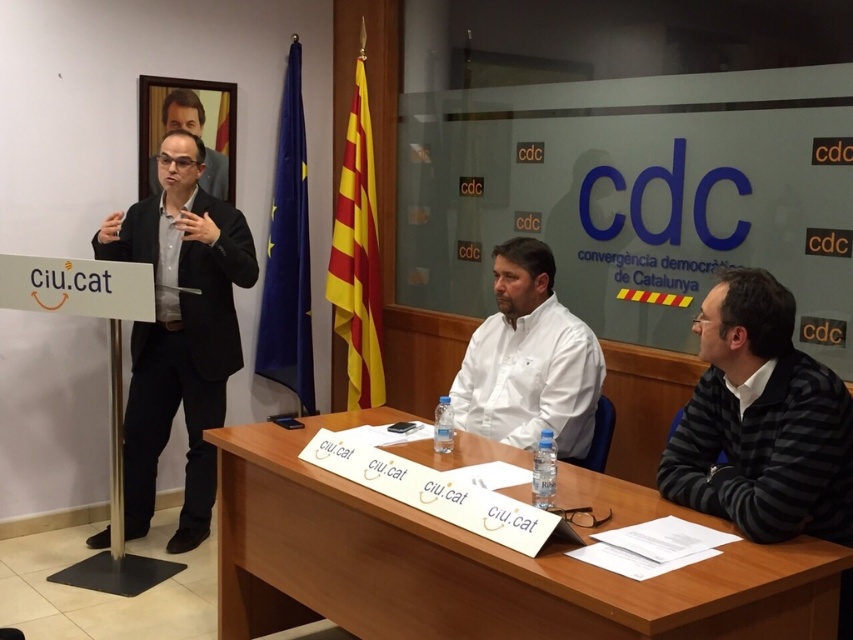
Question: Is light brown wooden table at center positioned at the back of matte black suit at upper left?

Choices:
 (A) no
 (B) yes

Answer: (A)

Question: Which point is closer to the camera?

Choices:
 (A) white cotton shirt at center
 (B) black suit at left
 (C) black striped sweater at right
 (D) light brown wooden table at center

Answer: (D)

Question: Which of the following is the closest to the observer?

Choices:
 (A) (703, 320)
 (B) (241, 355)

Answer: (A)

Question: Is black striped sweater at right to the right of matte black suit at upper left from the viewer's perspective?

Choices:
 (A) yes
 (B) no

Answer: (A)

Question: Is light brown wooden table at center to the right of white cotton shirt at center from the viewer's perspective?

Choices:
 (A) yes
 (B) no

Answer: (B)

Question: Which of the following is the farthest from the observer?

Choices:
 (A) black suit at left
 (B) white cotton shirt at center
 (C) black striped sweater at right

Answer: (A)